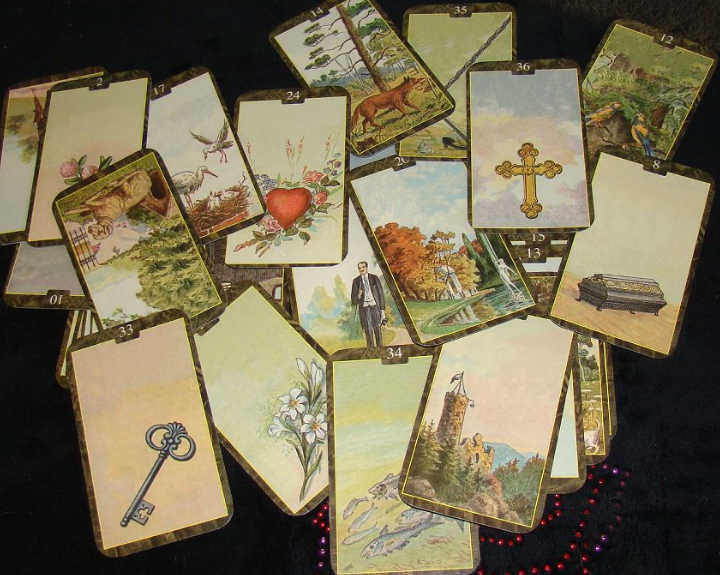
Find the location of `prayer cards`. prayer cards is located at coordinates (659, 310), (552, 196), (314, 237).